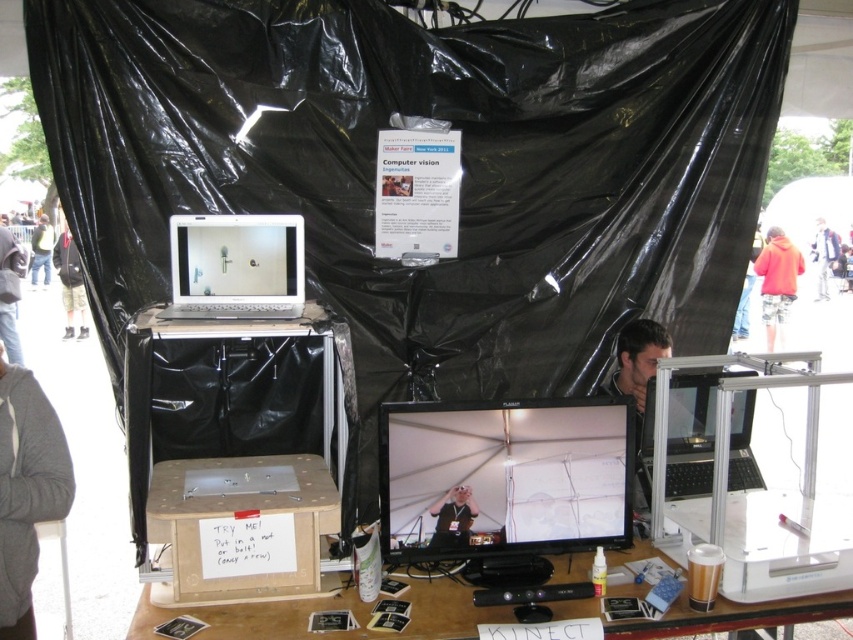
Question: Is wooden at center behind black plastic laptop at center?

Choices:
 (A) yes
 (B) no

Answer: (B)

Question: Which of the following is the farthest from the observer?

Choices:
 (A) (786, 282)
 (B) (186, 612)
 (C) (0, 248)

Answer: (A)

Question: Among these points, which one is farthest from the camera?

Choices:
 (A) (828, 230)
 (B) (772, 262)
 (C) (45, 284)

Answer: (A)

Question: Is wooden at center above gray fabric jacket at left?

Choices:
 (A) no
 (B) yes

Answer: (A)

Question: Is gray fabric jacket at lower left positioned in front of matte black laptop at upper left?

Choices:
 (A) yes
 (B) no

Answer: (A)

Question: Which point is farther to the camera?

Choices:
 (A) wooden at center
 (B) gray fabric jacket at lower left

Answer: (A)